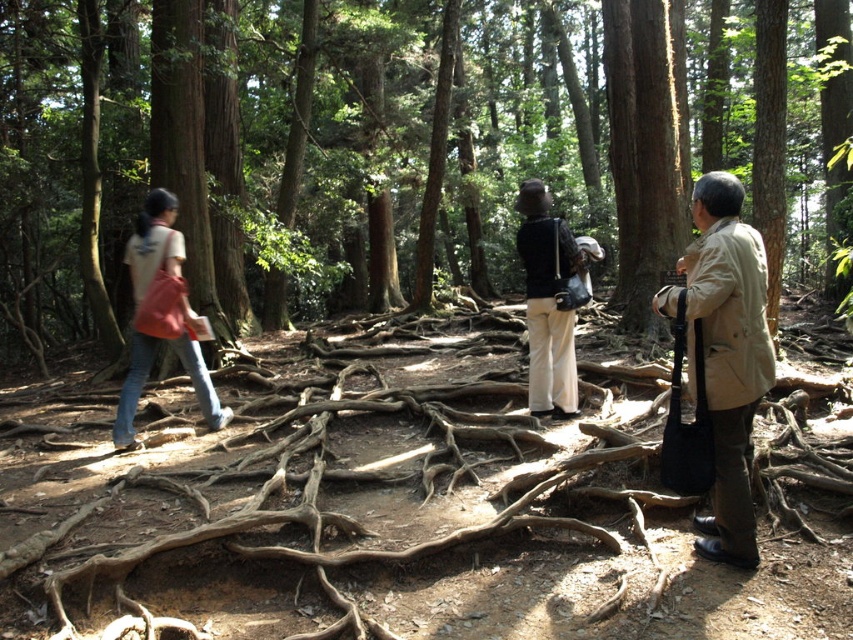
What do you see at coordinates (547, 301) in the screenshot?
I see `matte black jacket at center` at bounding box center [547, 301].

In the scene shown: Can you confirm if matte black jacket at center is positioned to the left of denim jeans at left?

No, matte black jacket at center is not to the left of denim jeans at left.

Measure the distance between point (570, 236) and camera.

Point (570, 236) and camera are 22.91 feet apart.

At what (x,y) coordinates should I click in order to perform the action: click on matte black jacket at center. Please return your answer as a coordinate pair (x, y). Image resolution: width=853 pixels, height=640 pixels. Looking at the image, I should click on (547, 301).

Is brown wood tree at center in front of denim jeans at left?

No, it is behind denim jeans at left.

Is point (15, 236) closer to camera compared to point (148, 241)?

That is False.

The height and width of the screenshot is (640, 853). Identify the location of brown wood tree at center. (273, 156).

Does beige fabric trench coat at right have a greater width compared to denim jeans at left?

No, beige fabric trench coat at right is not wider than denim jeans at left.

Does beige fabric trench coat at right have a larger size compared to denim jeans at left?

Yes.

Which is in front, point (688, 269) or point (209, 387)?

Point (688, 269) is in front.

The width and height of the screenshot is (853, 640). I want to click on beige fabric trench coat at right, so click(728, 356).